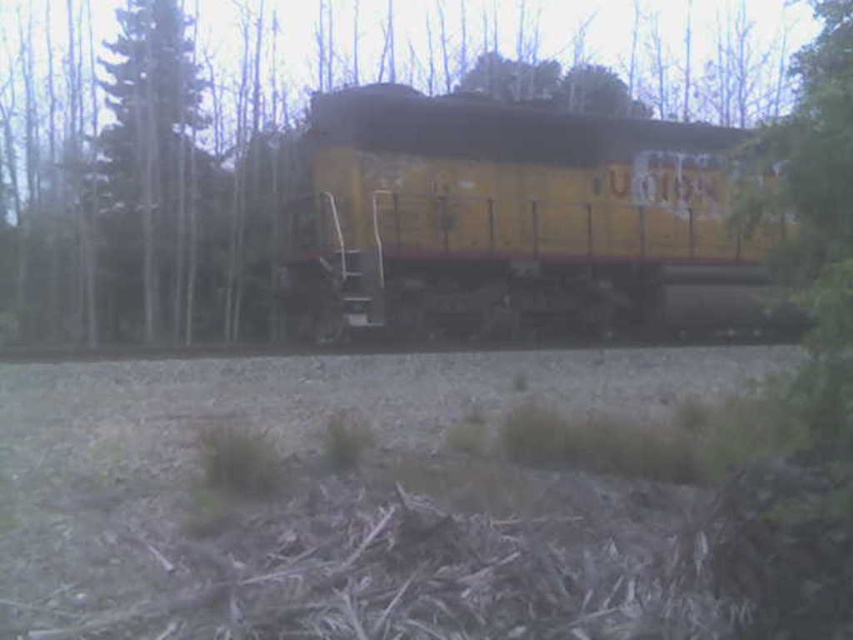
Question: Which object is the farthest from the yellow matte train at center?

Choices:
 (A) green textured tree at left
 (B) green leafy tree at center

Answer: (A)

Question: Can you confirm if green leafy tree at center is positioned to the right of green textured tree at left?

Choices:
 (A) yes
 (B) no

Answer: (A)

Question: Which point is farther to the camera?

Choices:
 (A) (112, 157)
 (B) (431, 278)

Answer: (A)

Question: Is green leafy tree at center to the left of green textured tree at left from the viewer's perspective?

Choices:
 (A) yes
 (B) no

Answer: (B)

Question: Estimate the real-world distances between objects in this image. Which object is farther from the yellow matte train at center?

Choices:
 (A) green textured tree at left
 (B) green leafy tree at center

Answer: (A)

Question: Does green leafy tree at center have a lesser width compared to green textured tree at left?

Choices:
 (A) yes
 (B) no

Answer: (B)